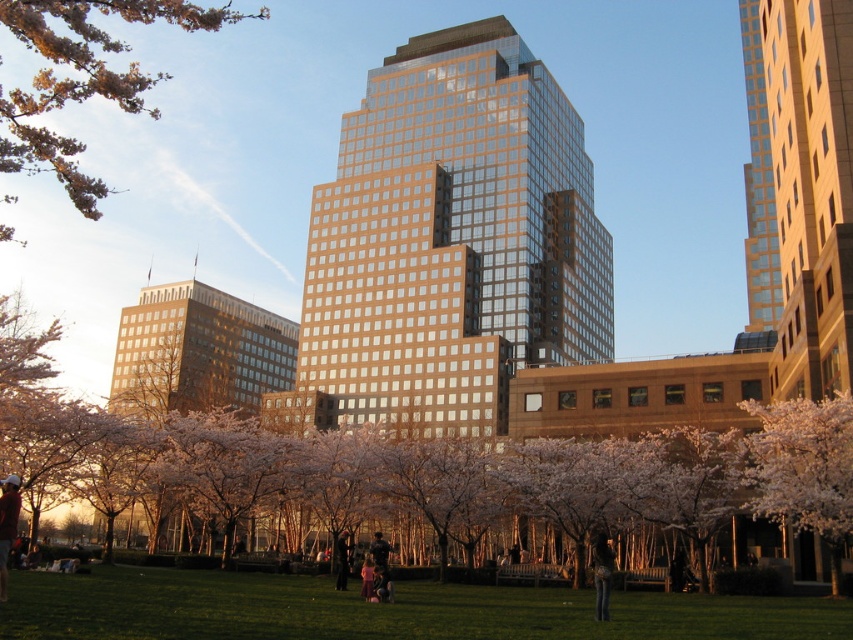
Question: Which object is the closest to the pink blossoms at upper left?

Choices:
 (A) dark gray sweater at center
 (B) dark brown leather jacket at lower left
 (C) pink blossoms at center

Answer: (C)

Question: Which object appears farthest from the camera in this image?

Choices:
 (A) dark brown leather jacket at lower left
 (B) gold reflective glass building at center

Answer: (B)

Question: Which of these objects is positioned farthest from the dark gray sweater at center?

Choices:
 (A) pink blossoms at upper left
 (B) pink blossoms at center
 (C) gold reflective glass building at center

Answer: (A)

Question: Observing the image, what is the correct spatial positioning of pink blossoms at upper left in reference to dark gray sweater at center?

Choices:
 (A) right
 (B) left

Answer: (B)

Question: Can you confirm if pink blossoms at upper left is wider than dark gray sweater at center?

Choices:
 (A) no
 (B) yes

Answer: (B)

Question: Is green grass at lower center further to the viewer compared to pink blossoms at upper left?

Choices:
 (A) yes
 (B) no

Answer: (B)